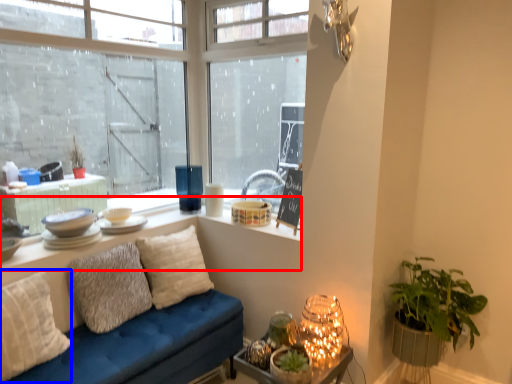
Question: Which object appears farthest to the camera in this image, window (highlighted by a red box) or pillow (highlighted by a blue box)?

Choices:
 (A) window
 (B) pillow

Answer: (A)